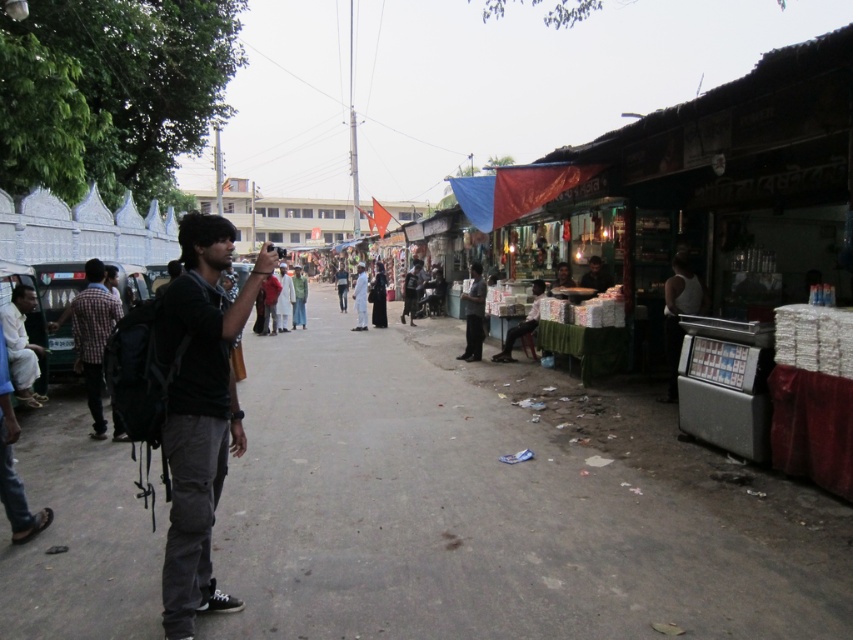
You are a photographer trying to capture the scene. You notice the checkered fabric shirt at left and the dark gray pants at center. Which one is positioned lower in the image?

The checkered fabric shirt at left is positioned lower in the image because it is below the dark gray pants at center.

You are standing at the point marked by the coordinates point [498,506] in the image. What is the material of the surface you are currently standing on?

The point [498,506] corresponds to dark gray asphalt at center, so the surface is asphalt.